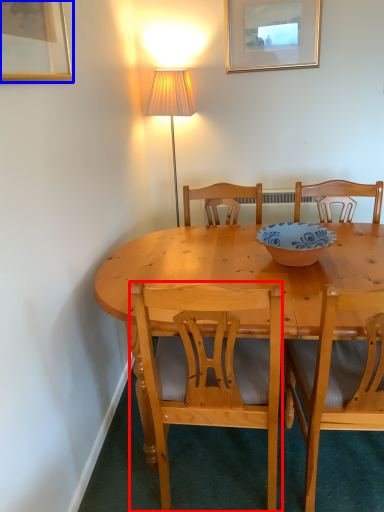
Question: Which object appears closest to the camera in this image, chair (highlighted by a red box) or picture frame (highlighted by a blue box)?

Choices:
 (A) chair
 (B) picture frame

Answer: (B)